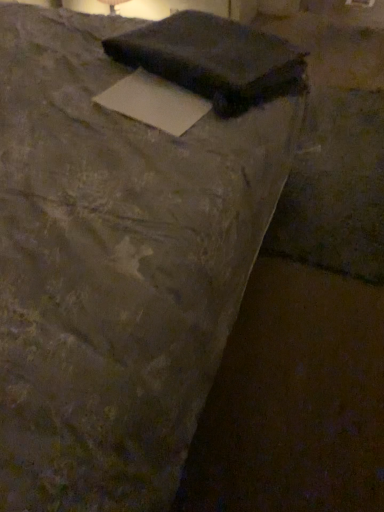
Question: Is matte black laptop at upper center, which is the second writing from bottom to top, shorter than white paper at center, the second writing from the top?

Choices:
 (A) no
 (B) yes

Answer: (A)

Question: Are matte black laptop at upper center, which ranks as the 1th writing in top-to-bottom order, and white paper at center, the second writing from the top, beside each other?

Choices:
 (A) no
 (B) yes

Answer: (A)

Question: Is matte black laptop at upper center, which ranks as the 1th writing in top-to-bottom order, thinner than white paper at center, the second writing from the top?

Choices:
 (A) yes
 (B) no

Answer: (B)

Question: Considering the relative sizes of matte black laptop at upper center, which is the second writing from bottom to top, and white paper at center, the second writing from the top, in the image provided, is matte black laptop at upper center, which is the second writing from bottom to top, taller than white paper at center, the second writing from the top,?

Choices:
 (A) no
 (B) yes

Answer: (B)

Question: Is the position of matte black laptop at upper center, which ranks as the 1th writing in top-to-bottom order, more distant than that of white paper at center, marked as the 1th writing in a bottom-to-top arrangement?

Choices:
 (A) yes
 (B) no

Answer: (A)

Question: Is matte black laptop at upper center, which is the second writing from bottom to top, aimed at white paper at center, marked as the 1th writing in a bottom-to-top arrangement?

Choices:
 (A) yes
 (B) no

Answer: (B)

Question: Is white paper at center, the second writing from the top, to the left of matte black laptop at upper center, which ranks as the 1th writing in top-to-bottom order, from the viewer's perspective?

Choices:
 (A) no
 (B) yes

Answer: (B)

Question: Is white paper at center, marked as the 1th writing in a bottom-to-top arrangement, directly adjacent to matte black laptop at upper center, which is the second writing from bottom to top?

Choices:
 (A) yes
 (B) no

Answer: (B)

Question: From the image's perspective, is white paper at center, the second writing from the top, below matte black laptop at upper center, which ranks as the 1th writing in top-to-bottom order?

Choices:
 (A) no
 (B) yes

Answer: (B)

Question: Is white paper at center, marked as the 1th writing in a bottom-to-top arrangement, oriented away from matte black laptop at upper center, which is the second writing from bottom to top?

Choices:
 (A) yes
 (B) no

Answer: (B)

Question: Is white paper at center, marked as the 1th writing in a bottom-to-top arrangement, wider than matte black laptop at upper center, which is the second writing from bottom to top?

Choices:
 (A) yes
 (B) no

Answer: (B)

Question: Considering the relative sizes of white paper at center, marked as the 1th writing in a bottom-to-top arrangement, and matte black laptop at upper center, which ranks as the 1th writing in top-to-bottom order, in the image provided, is white paper at center, marked as the 1th writing in a bottom-to-top arrangement, taller than matte black laptop at upper center, which ranks as the 1th writing in top-to-bottom order,?

Choices:
 (A) yes
 (B) no

Answer: (B)

Question: In terms of width, does white paper at center, the second writing from the top, look wider or thinner when compared to matte black laptop at upper center, which is the second writing from bottom to top?

Choices:
 (A) wide
 (B) thin

Answer: (B)